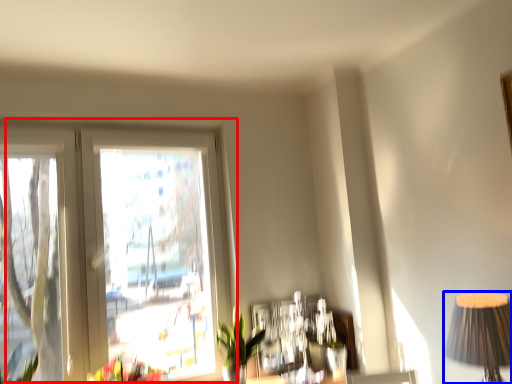
Question: Among these objects, which one is farthest to the camera, window (highlighted by a red box) or table lamp (highlighted by a blue box)?

Choices:
 (A) window
 (B) table lamp

Answer: (A)